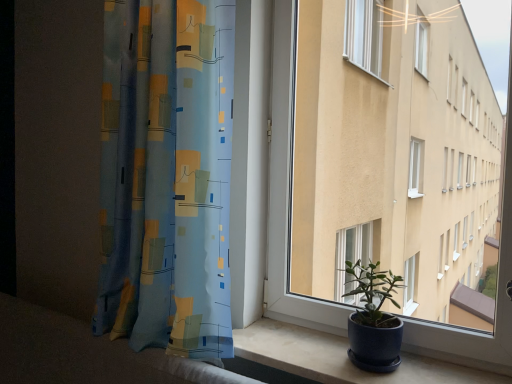
Where is `free location to the right of matte blue pot at lower right`? This screenshot has width=512, height=384. free location to the right of matte blue pot at lower right is located at coordinates (430, 368).